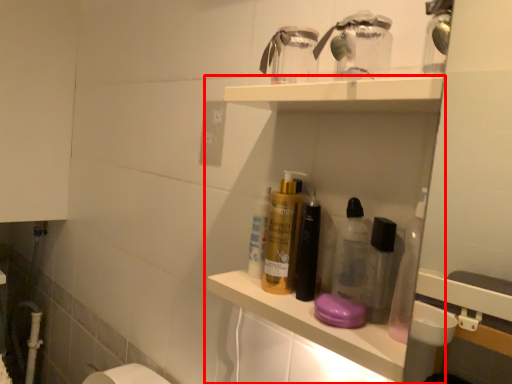
Question: Observing the image, what is the correct spatial positioning of shelf (annotated by the red box) in reference to electric outlet?

Choices:
 (A) left
 (B) right

Answer: (B)